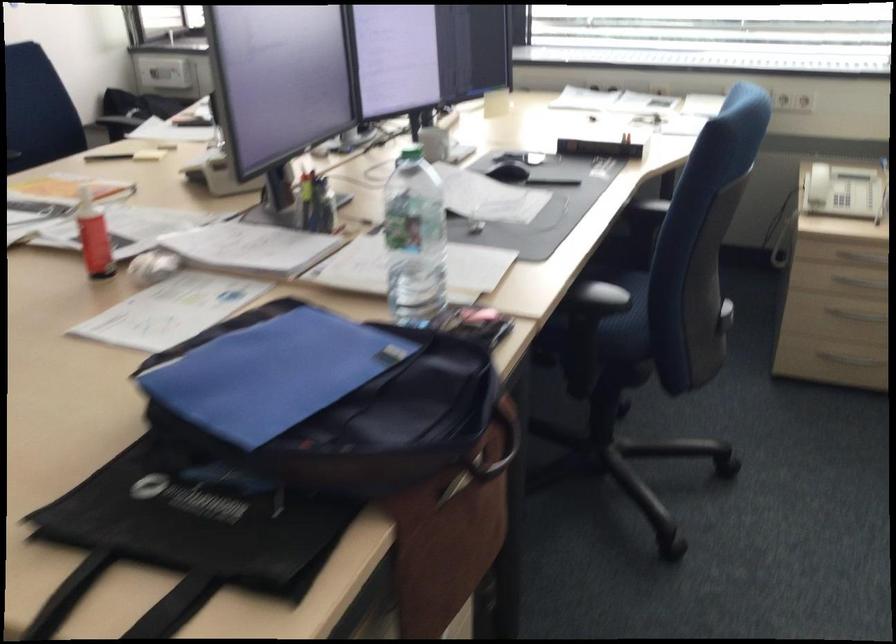
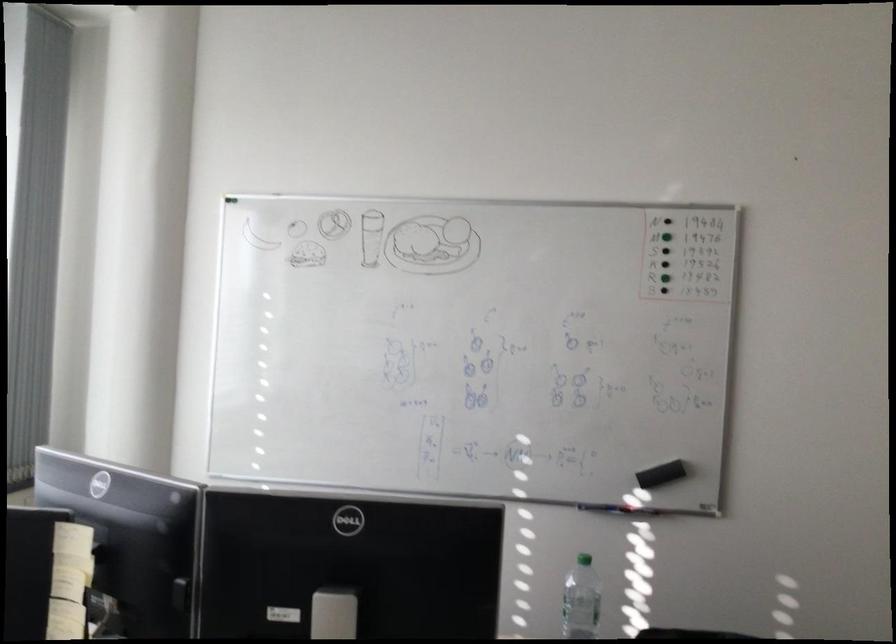
Locate, in the second image, the point that corresponds to point 417,229 in the first image.

(581, 600)